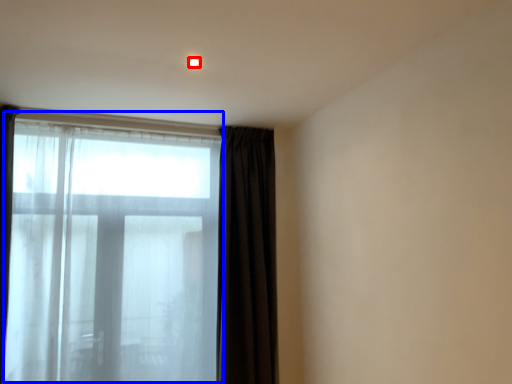
Question: Among these objects, which one is nearest to the camera, light (highlighted by a red box) or bay window (highlighted by a blue box)?

Choices:
 (A) light
 (B) bay window

Answer: (A)